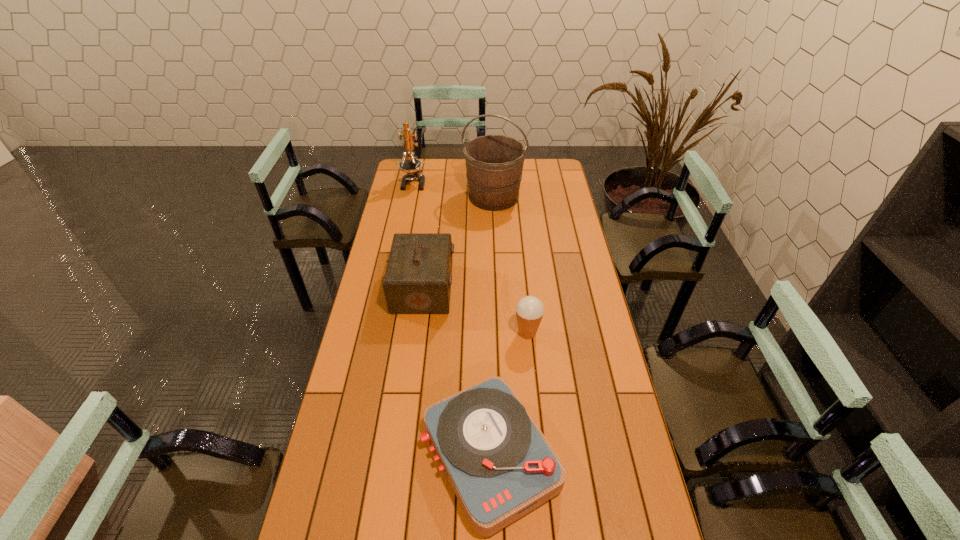
Locate an element on the screen. The height and width of the screenshot is (540, 960). the tallest object is located at coordinates (494, 163).

Image resolution: width=960 pixels, height=540 pixels. In order to click on the second tallest object in this screenshot , I will do `click(412, 166)`.

Where is `the third tallest object`? Image resolution: width=960 pixels, height=540 pixels. the third tallest object is located at coordinates (418, 278).

You are a GUI agent. You are given a task and a screenshot of the screen. Output one action in this format:
    pyautogui.click(x=<x>, y=<y>)
    Task: Click on the first-aid kit
    This screenshot has width=960, height=540.
    Given the screenshot: What is the action you would take?
    pyautogui.click(x=418, y=278)

Find the location of `the second shortest object`. the second shortest object is located at coordinates (529, 310).

Where is `the second nearest object`? The height and width of the screenshot is (540, 960). the second nearest object is located at coordinates (529, 310).

Identify the location of record player. Image resolution: width=960 pixels, height=540 pixels. (500, 465).

The width and height of the screenshot is (960, 540). Find the location of `the nearest object`. the nearest object is located at coordinates (500, 465).

At what (x,y) coordinates should I click in order to perform the action: click on blank space located on the left of the tallest object. Please return your answer as a coordinate pair (x, y). The height and width of the screenshot is (540, 960). Looking at the image, I should click on (x=391, y=197).

I want to click on vacant region located at the eyepiece of the second tallest object, so click(403, 234).